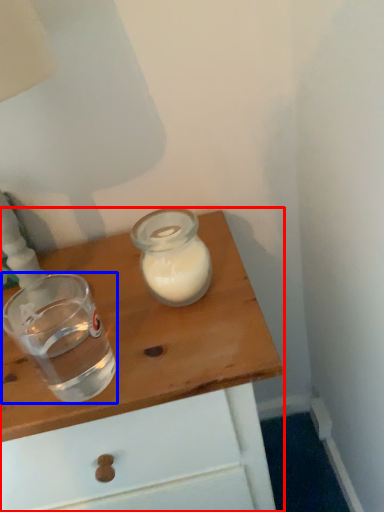
Question: Which of the following is the closest to the observer, table (highlighted by a red box) or shot glass (highlighted by a blue box)?

Choices:
 (A) table
 (B) shot glass

Answer: (B)